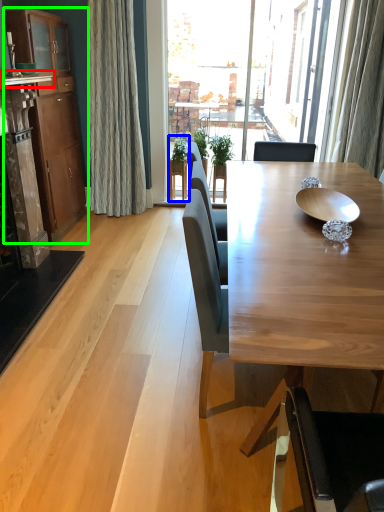
Question: Considering the real-world distances, which object is closest to counter top (highlighted by a red box)? houseplant (highlighted by a blue box) or cabinetry (highlighted by a green box).

Choices:
 (A) houseplant
 (B) cabinetry

Answer: (B)